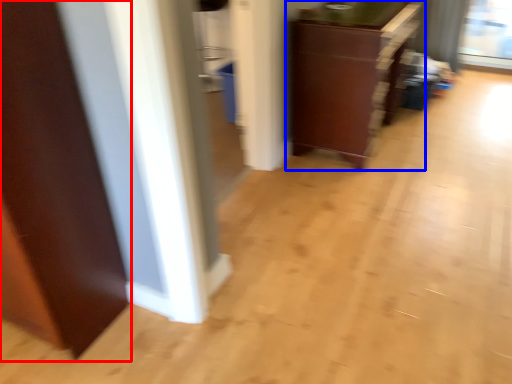
Question: Which point is further to the camera, door (highlighted by a red box) or cabinetry (highlighted by a blue box)?

Choices:
 (A) door
 (B) cabinetry

Answer: (B)